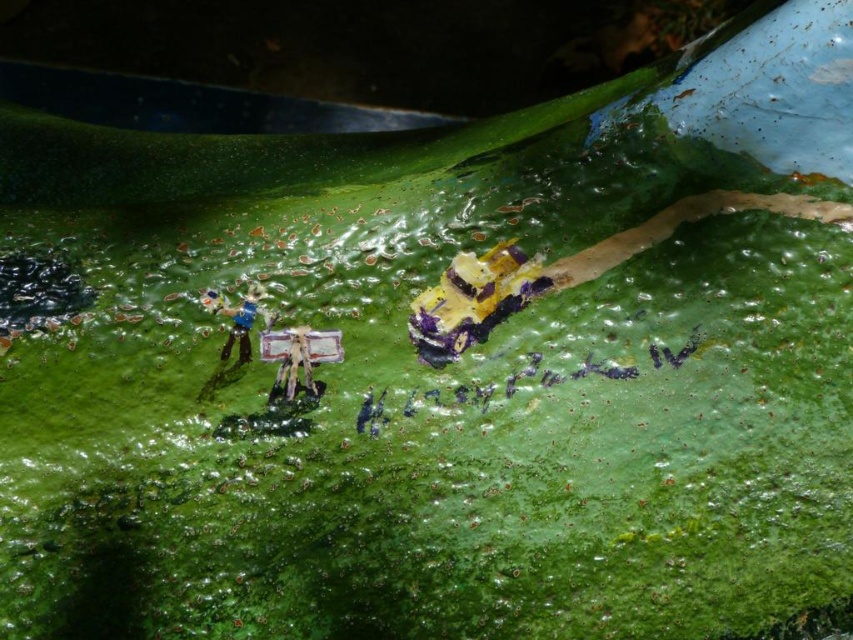
Question: Among these points, which one is farthest from the camera?

Choices:
 (A) (512, 272)
 (B) (300, 356)

Answer: (A)

Question: Does yellow and purple plastic toy at center appear over metallic silver figure at center?

Choices:
 (A) no
 (B) yes

Answer: (B)

Question: Can you confirm if yellow and purple plastic toy at center is smaller than matte plastic figure at upper left?

Choices:
 (A) no
 (B) yes

Answer: (A)

Question: Which object is the closest to the matte plastic figure at upper left?

Choices:
 (A) metallic silver figure at center
 (B) yellow and purple plastic toy at center

Answer: (A)

Question: Can you confirm if yellow and purple plastic toy at center is positioned to the left of matte plastic figure at upper left?

Choices:
 (A) yes
 (B) no

Answer: (B)

Question: Which point is farther to the camera?

Choices:
 (A) metallic silver figure at center
 (B) yellow and purple plastic toy at center
 (C) matte plastic figure at upper left

Answer: (C)